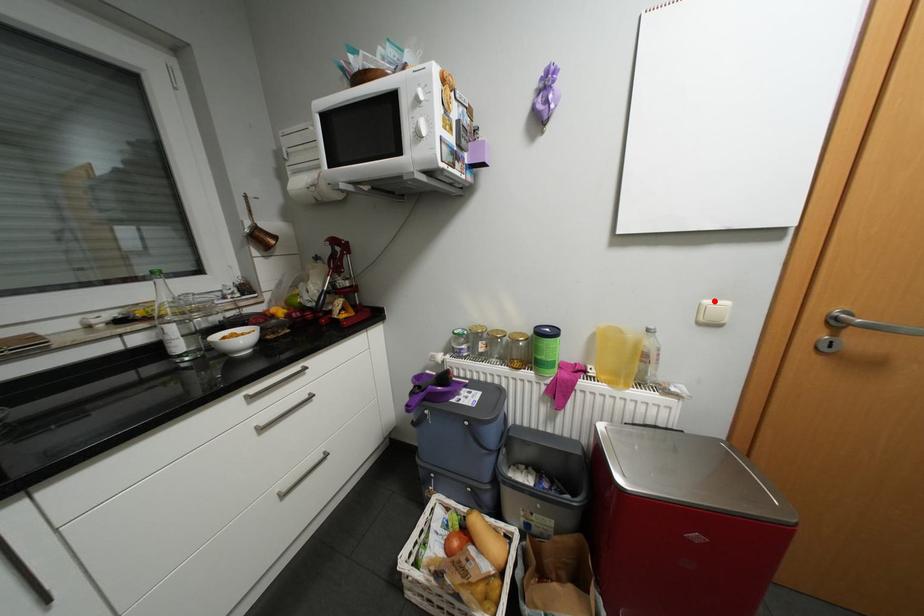
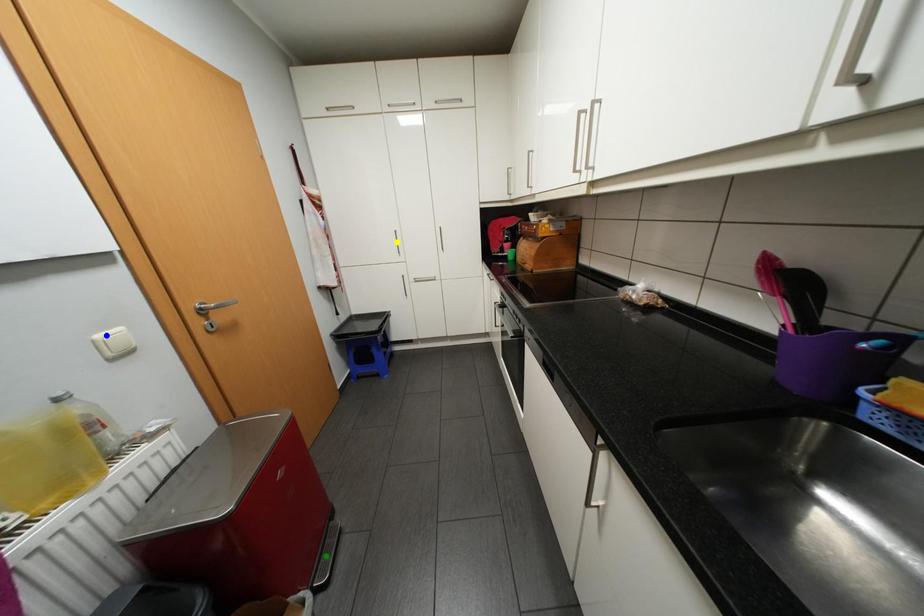
Question: I am providing you with two images of the same scene from different viewpoints. A red point is marked on the first image. You are given multiple points on the second image. Which spot in image 2 lines up with the point in image 1?

Choices:
 (A) green point
 (B) yellow point
 (C) blue point

Answer: (C)